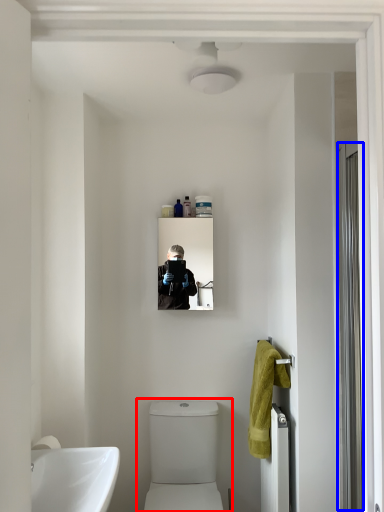
Question: Which of the following is the farthest to the observer, toilet (highlighted by a red box) or screen door (highlighted by a blue box)?

Choices:
 (A) toilet
 (B) screen door

Answer: (A)